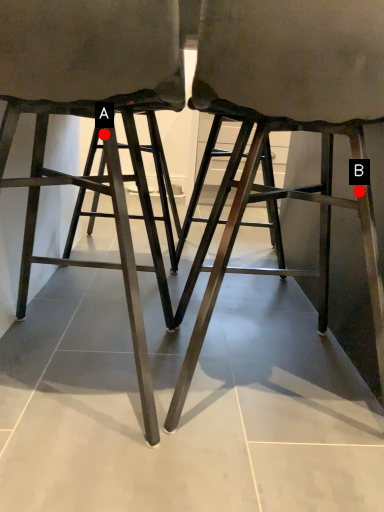
Question: Two points are circled on the image, labeled by A and B beside each circle. Which point appears farthest from the camera in this image?

Choices:
 (A) A is further
 (B) B is further

Answer: (B)